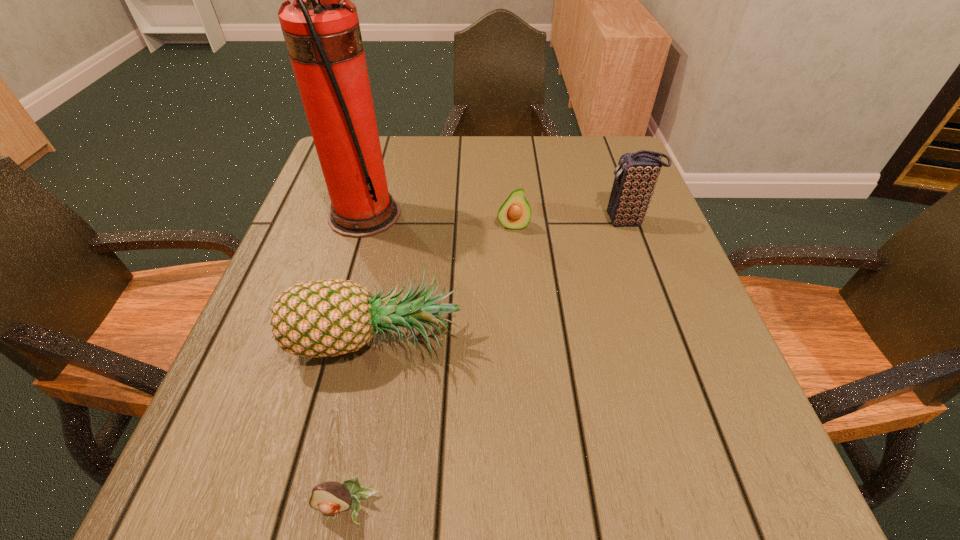
Identify the location of free space between the fourth object from left to right and the shortest object. This screenshot has width=960, height=540. (430, 367).

The height and width of the screenshot is (540, 960). I want to click on vacant region between the nearest object and the fourth object from left to right, so click(430, 367).

Find the location of a particular element. This screenshot has width=960, height=540. vacant space that is in between the pineapple and the farther avocado is located at coordinates (445, 281).

Where is `vacant area between the tallest object and the second nearest object`? vacant area between the tallest object and the second nearest object is located at coordinates (371, 276).

Identify which object is the third nearest to the fourth object from left to right. Please provide its 2D coordinates. Your answer should be formatted as a tuple, i.e. [(x, y)], where the tuple contains the x and y coordinates of a point satisfying the conditions above.

[(321, 29)]

Identify which object is the third closest to the tallest object. Please provide its 2D coordinates. Your answer should be formatted as a tuple, i.e. [(x, y)], where the tuple contains the x and y coordinates of a point satisfying the conditions above.

[(636, 175)]

Image resolution: width=960 pixels, height=540 pixels. Find the location of `free space that satisfies the following two spatial constraints: 1. at the discharge end of the fire extinguisher; 2. on the right side of the fourth farthest object`. free space that satisfies the following two spatial constraints: 1. at the discharge end of the fire extinguisher; 2. on the right side of the fourth farthest object is located at coordinates (328, 337).

Where is `free location that satisfies the following two spatial constraints: 1. with the zip open on the clutch bag; 2. on the seed side of the shortest object`? Image resolution: width=960 pixels, height=540 pixels. free location that satisfies the following two spatial constraints: 1. with the zip open on the clutch bag; 2. on the seed side of the shortest object is located at coordinates point(732,507).

Locate an element on the screen. The width and height of the screenshot is (960, 540). free region that satisfies the following two spatial constraints: 1. with the zip open on the rightmost object; 2. on the seed side of the nearer avocado is located at coordinates (x=732, y=507).